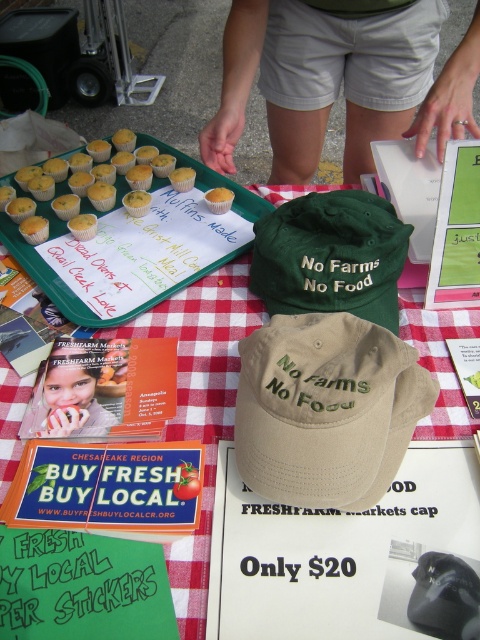
You are a customer at the FRESHFARM Markets event and you want to buy the green fabric baseball cap at center. The vendor tells you that the cap is 21.42 inches from the camera. If your hand can reach 20 inches, can you grab it?

The green fabric baseball cap at center is 21.42 inches from the camera. Since your hand can only reach 20 inches, you cannot grab it.

You are at an outdoor market and see a tan fabric cap at center. Where exactly is it positioned on the table?

The tan fabric cap at center is located at point (325, 410).

You are setting up a booth at a farmers market and need to place the tan fabric cap at center on the red checkered tablecloth at center. Based on the available space, will the cap fit entirely on the tablecloth without overlapping the edges?

The tan fabric cap at center occupies less space than the red checkered tablecloth at center, so yes, the cap will fit entirely on the tablecloth without overlapping the edges.